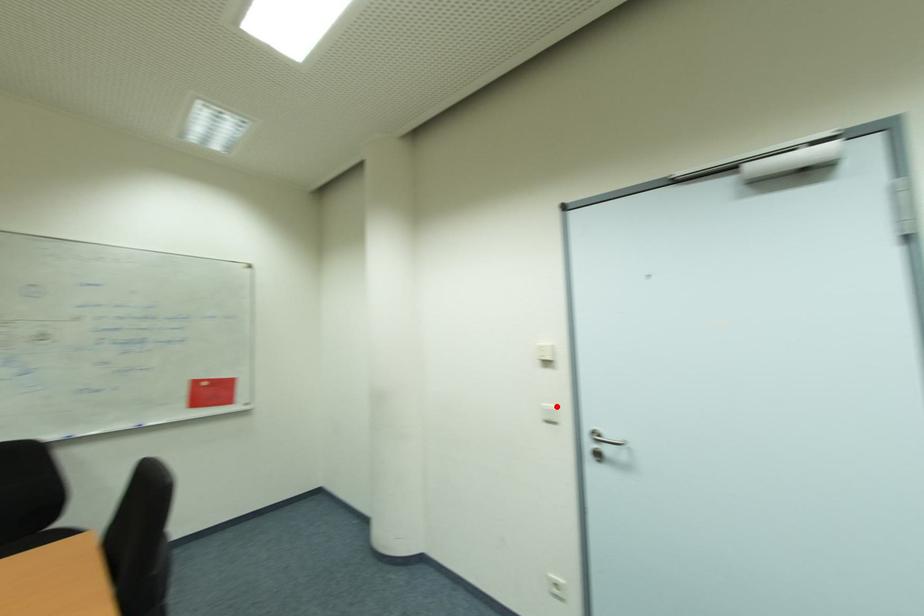
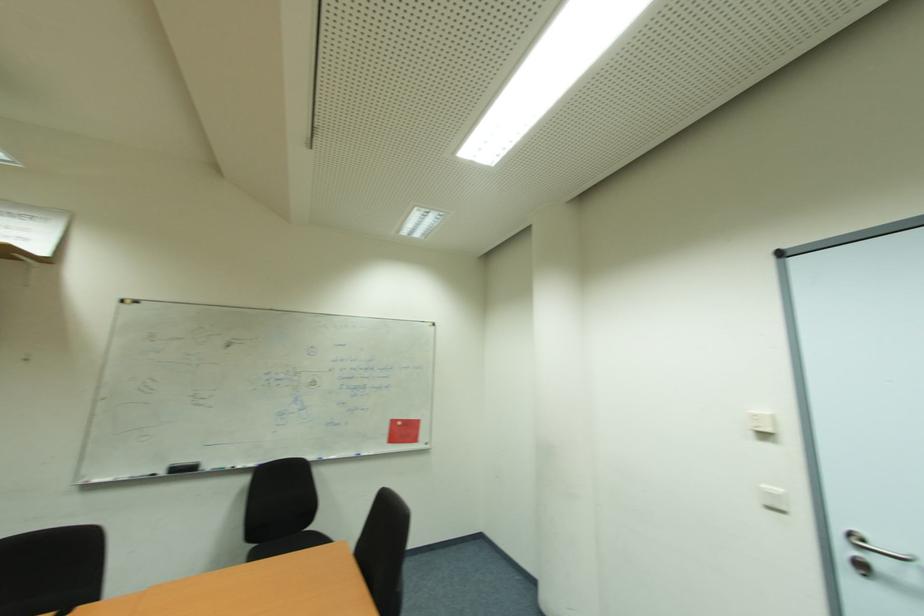
Question: I am providing you with two images of the same scene from different viewpoints. A red point is shown in image1. For the corresponding object point in image2, is it positioned nearer or farther from the camera?

Choices:
 (A) Nearer
 (B) Farther

Answer: (A)